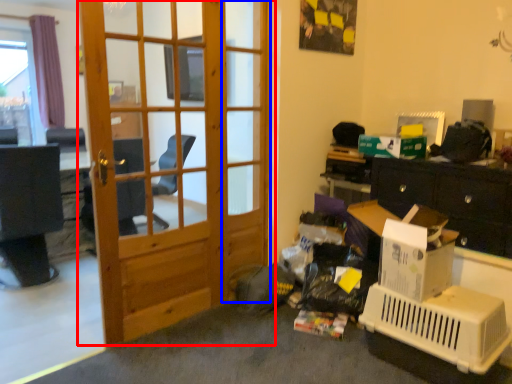
Question: Which object is further to the camera taking this photo, door (highlighted by a red box) or screen door (highlighted by a blue box)?

Choices:
 (A) door
 (B) screen door

Answer: (B)